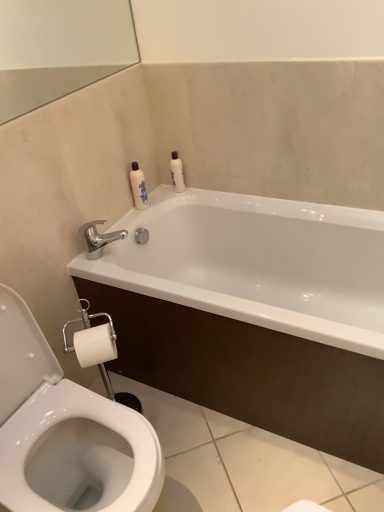
Where is `vacant space in front of polished metallic faucet at upper left`? vacant space in front of polished metallic faucet at upper left is located at coordinates (117, 271).